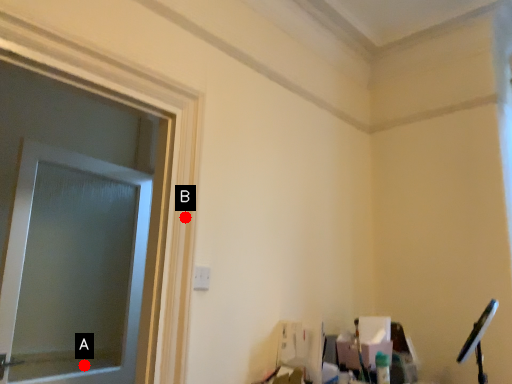
Question: Two points are circled on the image, labeled by A and B beside each circle. Which point is farther to the camera?

Choices:
 (A) A is further
 (B) B is further

Answer: (A)